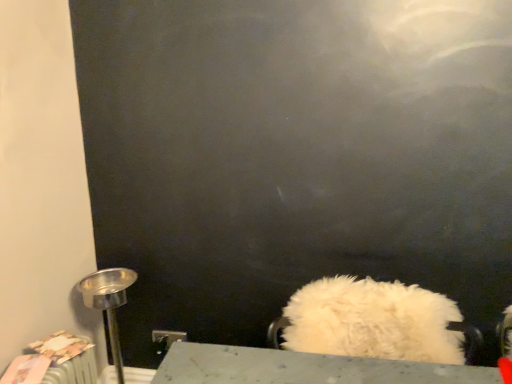
The height and width of the screenshot is (384, 512). What do you see at coordinates (108, 303) in the screenshot?
I see `metallic silver table lamp at left` at bounding box center [108, 303].

Locate an element on the screen. metallic silver table lamp at left is located at coordinates (108, 303).

Describe the element at coordinates (342, 341) in the screenshot. I see `white fluffy cushion at lower center` at that location.

The width and height of the screenshot is (512, 384). Find the location of `white fluffy cushion at lower center`. white fluffy cushion at lower center is located at coordinates (342, 341).

What is the approximate width of white fluffy cushion at lower center?

The width of white fluffy cushion at lower center is 52.52 centimeters.

Locate an element on the screen. This screenshot has width=512, height=384. metallic silver table lamp at left is located at coordinates 108,303.

Considering the relative positions of white fluffy cushion at lower center and metallic silver table lamp at left in the image provided, is white fluffy cushion at lower center to the right of metallic silver table lamp at left from the viewer's perspective?

Yes, white fluffy cushion at lower center is to the right of metallic silver table lamp at left.

Based on the photo, is white fluffy cushion at lower center further to the viewer compared to metallic silver table lamp at left?

No, white fluffy cushion at lower center is in front of metallic silver table lamp at left.

Between point (375, 297) and point (116, 292), which one is positioned behind?

The point (116, 292) is behind.

In the scene shown: From the image's perspective, which object appears higher, white fluffy cushion at lower center or metallic silver table lamp at left?

white fluffy cushion at lower center is shown above in the image.

From a real-world perspective, is white fluffy cushion at lower center physically located above or below metallic silver table lamp at left?

From a real-world perspective, white fluffy cushion at lower center is physically above metallic silver table lamp at left.

Considering the relative sizes of white fluffy cushion at lower center and metallic silver table lamp at left in the image provided, is white fluffy cushion at lower center wider than metallic silver table lamp at left?

Yes, white fluffy cushion at lower center is wider than metallic silver table lamp at left.

Based on the photo, which of these two, white fluffy cushion at lower center or metallic silver table lamp at left, stands shorter?

white fluffy cushion at lower center is shorter.

Can you confirm if white fluffy cushion at lower center is bigger than metallic silver table lamp at left?

Yes, white fluffy cushion at lower center is bigger than metallic silver table lamp at left.

Does white fluffy cushion at lower center contain metallic silver table lamp at left?

No.

Is white fluffy cushion at lower center not near metallic silver table lamp at left?

No, there isn't a large distance between white fluffy cushion at lower center and metallic silver table lamp at left.

Is white fluffy cushion at lower center positioned with its back to metallic silver table lamp at left?

white fluffy cushion at lower center is not turned away from metallic silver table lamp at left.

Based on the photo, how many degrees apart are the facing directions of white fluffy cushion at lower center and metallic silver table lamp at left?

white fluffy cushion at lower center and metallic silver table lamp at left are facing 90.5 degrees away from each other.

Measure the distance between white fluffy cushion at lower center and metallic silver table lamp at left.

white fluffy cushion at lower center and metallic silver table lamp at left are 30.91 inches apart.

This screenshot has height=384, width=512. I want to click on table lamp below the white fluffy cushion at lower center (from the image's perspective), so click(108, 303).

Does metallic silver table lamp at left appear on the right side of white fluffy cushion at lower center?

In fact, metallic silver table lamp at left is to the left of white fluffy cushion at lower center.

Relative to white fluffy cushion at lower center, is metallic silver table lamp at left in front or behind?

Visually, metallic silver table lamp at left is located behind white fluffy cushion at lower center.

Does point (110, 311) come behind point (314, 297)?

Yes, it is behind point (314, 297).

From the image's perspective, would you say metallic silver table lamp at left is shown under white fluffy cushion at lower center?

Yes, from the image's perspective, metallic silver table lamp at left is below white fluffy cushion at lower center.

From a real-world perspective, which object rests below the other?

From a 3D spatial view, metallic silver table lamp at left is below.

Which of these two, metallic silver table lamp at left or white fluffy cushion at lower center, is wider?

white fluffy cushion at lower center.

Considering the relative sizes of metallic silver table lamp at left and white fluffy cushion at lower center in the image provided, is metallic silver table lamp at left shorter than white fluffy cushion at lower center?

In fact, metallic silver table lamp at left may be taller than white fluffy cushion at lower center.

Is metallic silver table lamp at left bigger than white fluffy cushion at lower center?

Actually, metallic silver table lamp at left might be smaller than white fluffy cushion at lower center.

Could white fluffy cushion at lower center be considered to be inside metallic silver table lamp at left?

No, white fluffy cushion at lower center is located outside of metallic silver table lamp at left.

Is metallic silver table lamp at left beside white fluffy cushion at lower center?

metallic silver table lamp at left is not next to white fluffy cushion at lower center, and they're not touching.

Is metallic silver table lamp at left oriented away from white fluffy cushion at lower center?

That's not correct — metallic silver table lamp at left is not looking away from white fluffy cushion at lower center.

I want to click on table lamp behind the white fluffy cushion at lower center, so click(108, 303).

Find the location of a particular element. This screenshot has width=512, height=384. sink on the right side of metallic silver table lamp at left is located at coordinates (342, 341).

Locate an element on the screen. table lamp that appears below the white fluffy cushion at lower center (from the image's perspective) is located at coordinates (108, 303).